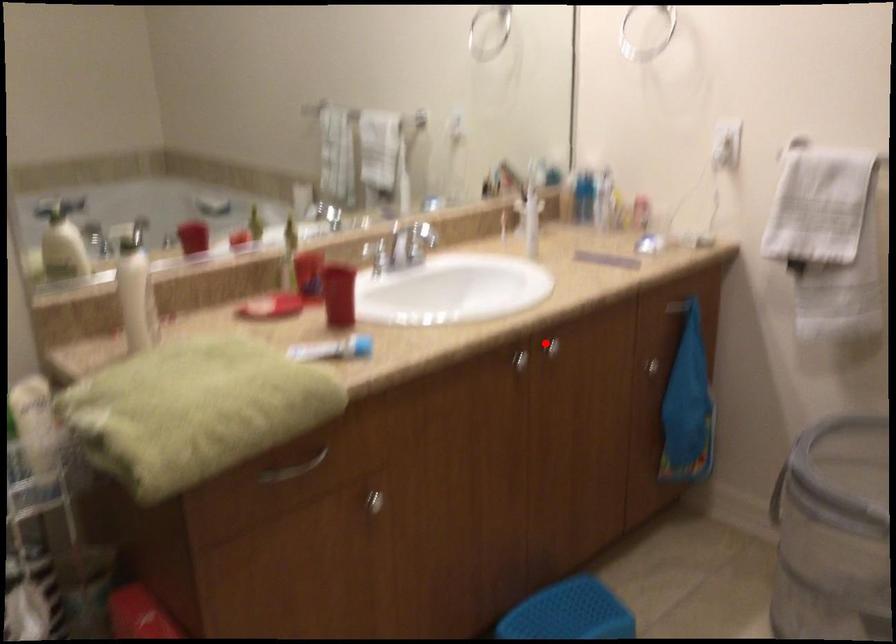
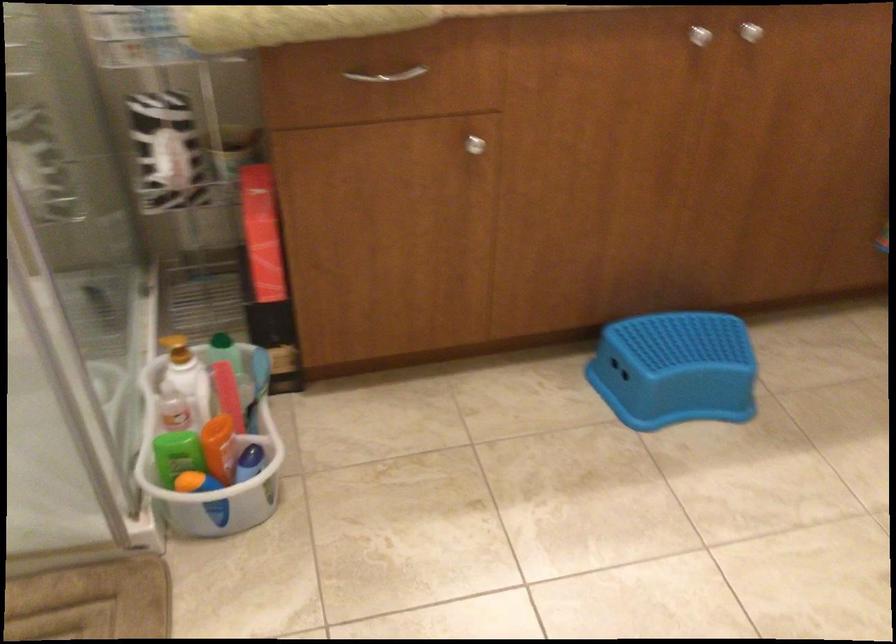
The point at the highlighted location is marked in the first image. Where is the corresponding point in the second image?

(751, 32)